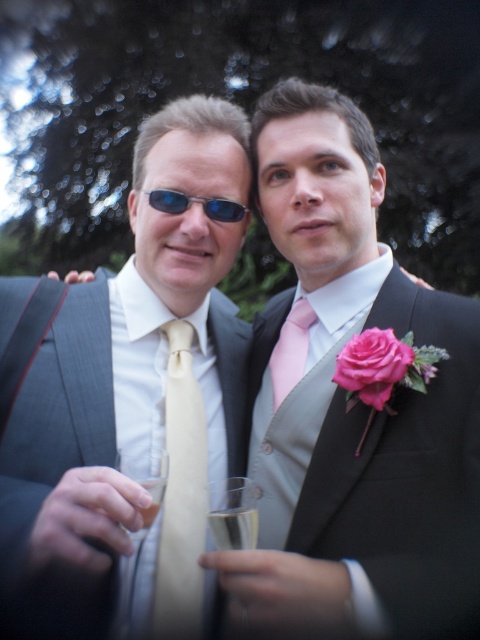
Question: Is black satin suit at center above matte gold tie at center?

Choices:
 (A) no
 (B) yes

Answer: (B)

Question: Can you confirm if matte gray suit at left is bigger than pink satin tie at center?

Choices:
 (A) no
 (B) yes

Answer: (B)

Question: Which of the following is the closest to the observer?

Choices:
 (A) black satin suit at center
 (B) pink satin tie at center
 (C) matte gray suit at left

Answer: (C)

Question: Is matte gray suit at left behind matte gold tie at center?

Choices:
 (A) no
 (B) yes

Answer: (A)

Question: Which of the following is the closest to the observer?

Choices:
 (A) blue reflective sunglasses at upper center
 (B) matte gold tie at center
 (C) matte gray suit at left

Answer: (C)

Question: Which point is farther to the camera?

Choices:
 (A) (230, 204)
 (B) (420, 570)
 (C) (277, 378)
 (D) (108, 586)

Answer: (C)